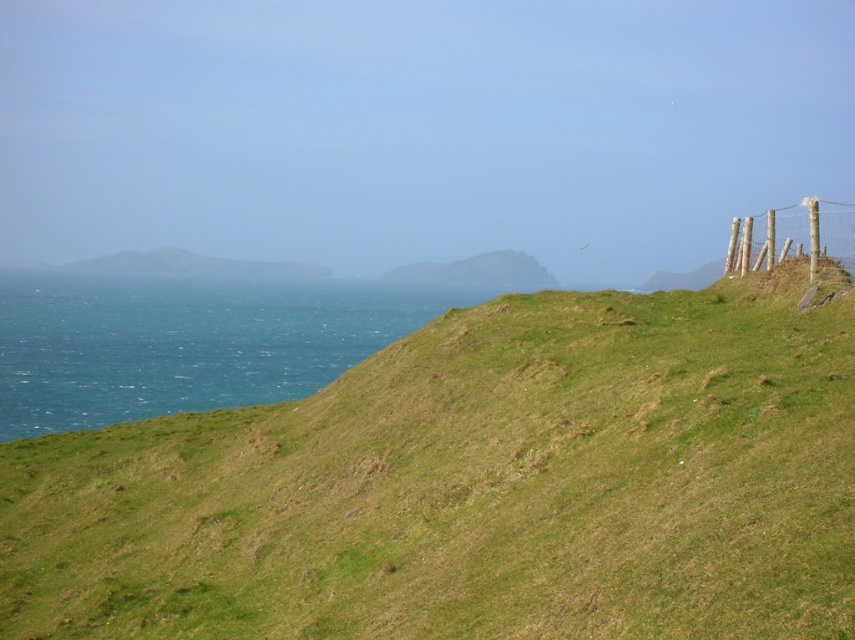
Question: Is blue water at left to the left of wooden post fence at upper right from the viewer's perspective?

Choices:
 (A) no
 (B) yes

Answer: (B)

Question: Estimate the real-world distances between objects in this image. Which object is farther from the wooden post fence at upper right?

Choices:
 (A) blue water at left
 (B) green grassy hillside at upper right

Answer: (A)

Question: Estimate the real-world distances between objects in this image. Which object is farther from the blue water at left?

Choices:
 (A) wooden post fence at upper right
 (B) green grassy hillside at upper right

Answer: (A)

Question: Which point is farther from the camera taking this photo?

Choices:
 (A) (752, 243)
 (B) (107, 321)

Answer: (B)

Question: Is blue water at left to the left of wooden post fence at upper right from the viewer's perspective?

Choices:
 (A) yes
 (B) no

Answer: (A)

Question: Observing the image, what is the correct spatial positioning of blue water at left in reference to wooden post fence at upper right?

Choices:
 (A) right
 (B) left

Answer: (B)